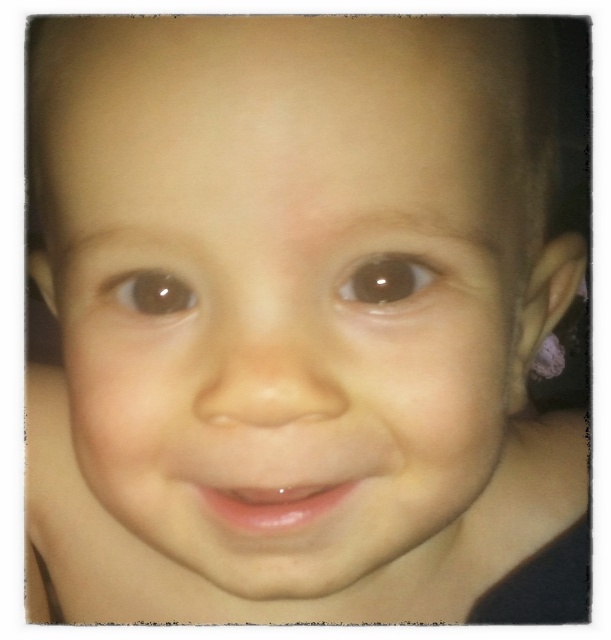
Find the location of a particular element. brown glossy eye at center is located at coordinates (387, 282).

This screenshot has height=640, width=611. Describe the element at coordinates (387, 282) in the screenshot. I see `brown glossy eye at center` at that location.

Where is `brown glossy eye at center`? The width and height of the screenshot is (611, 640). brown glossy eye at center is located at coordinates (387, 282).